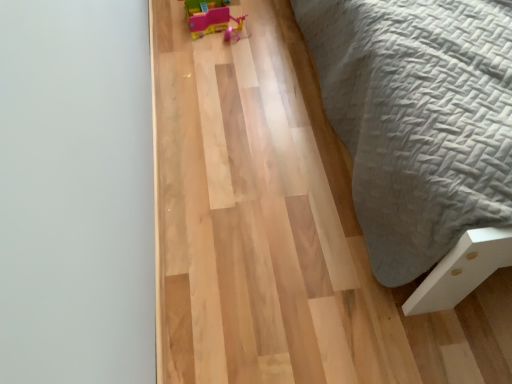
This screenshot has height=384, width=512. What are the coordinates of `free region under pink plastic toy at upper center (from a real-world perspective)` in the screenshot? It's located at (212, 18).